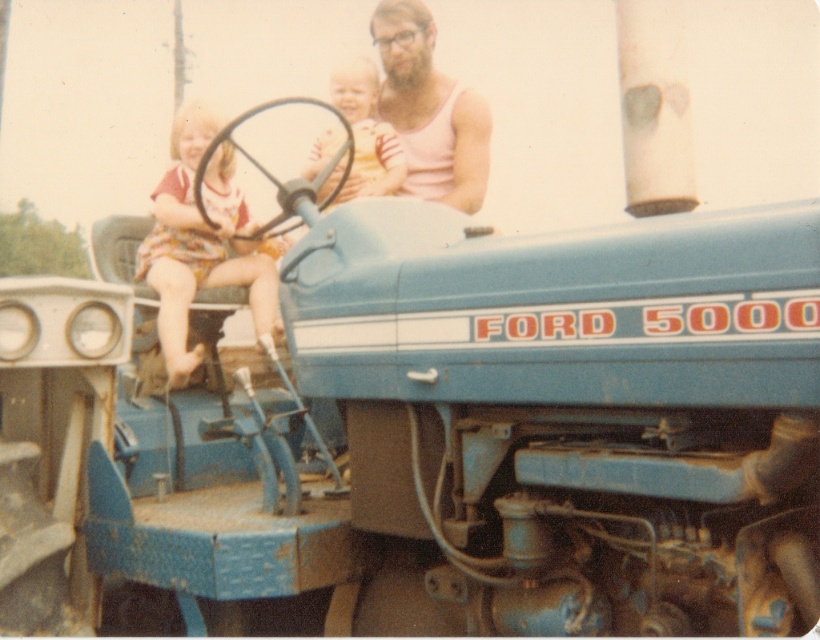
Describe the element at coordinates (196, 252) in the screenshot. I see `floral dress at left` at that location.

Image resolution: width=820 pixels, height=640 pixels. What are the coordinates of `floral dress at left` in the screenshot? It's located at (196, 252).

The image size is (820, 640). What are the coordinates of `floral dress at left` in the screenshot? It's located at (196, 252).

Does pink tank top at upper center come in front of striped fabric shirt at center?

No, it is behind striped fabric shirt at center.

The image size is (820, 640). Find the location of `pink tank top at upper center`. pink tank top at upper center is located at coordinates (429, 109).

Measure the distance between point (479, 205) and camera.

13.38 feet

The width and height of the screenshot is (820, 640). In order to click on pink tank top at upper center in this screenshot , I will do `click(429, 109)`.

Is point (276, 291) closer to viewer compared to point (345, 74)?

No, (276, 291) is behind (345, 74).

Does floral dress at left appear under striped fabric shirt at center?

Yes.

Locate an element on the screen. Image resolution: width=820 pixels, height=640 pixels. floral dress at left is located at coordinates (196, 252).

Locate an element on the screen. floral dress at left is located at coordinates (196, 252).